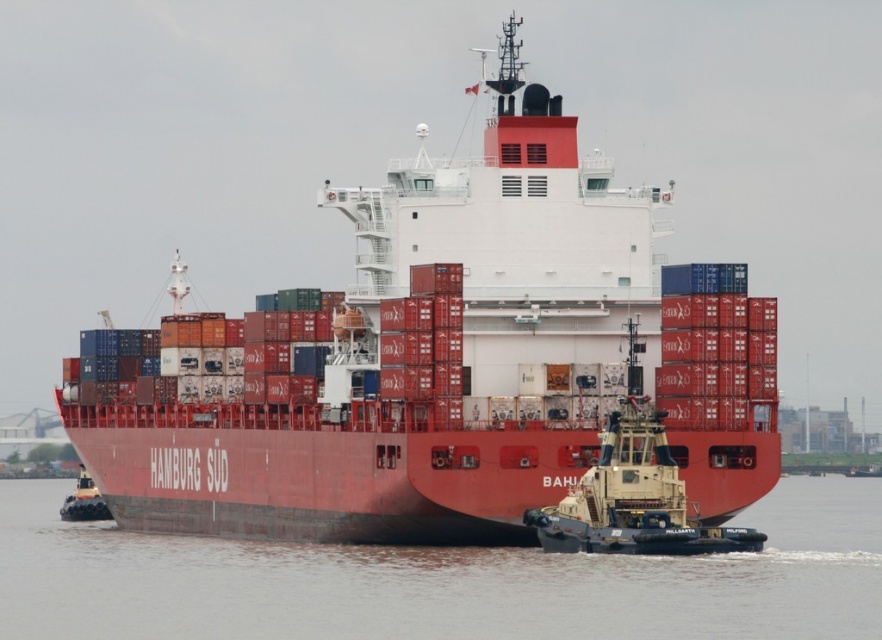
You are a sailor on the HAMBURG SUD ship and need to lower a lifeboat into the water. The lifeboat is currently stored on the deck above the smooth water at lower center. Which direction should you lower the lifeboat so that it ends up in the water near the camouflage paint tugboat at lower right?

You should lower the lifeboat downward from the deck above the smooth water at lower center towards the camouflage paint tugboat at lower right because the smooth water at lower center is below the camouflage paint tugboat at lower right, so lowering it downward will place it in the water near the tugboat.

In the scene shown: You are standing on the deck of the HAMBURG SUD ship and looking towards the tugboat BAHIA. There are two points marked on the deck at coordinates point (355, 508) and point (767, 580). Which point is closer to the front of the ship?

Point (355, 508) is behind point (767, 580), so the point closer to the front of the ship is point (767, 580).